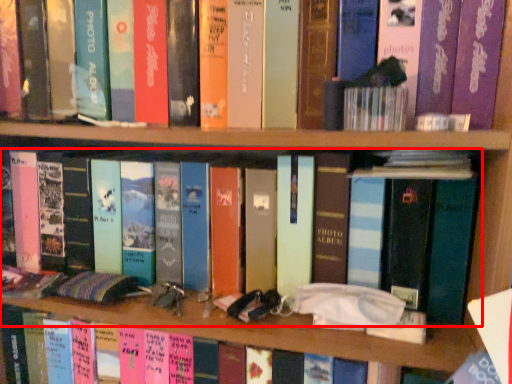
Question: From the image's perspective, what is the correct spatial relationship of book (annotated by the red box) in relation to book?

Choices:
 (A) below
 (B) above

Answer: (B)